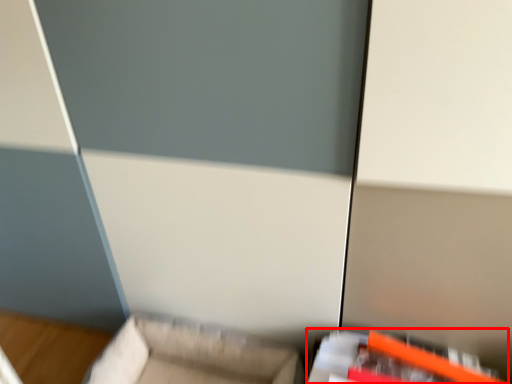
Question: From the image's perspective, considering the relative positions of furniture (annotated by the red box) and furniture in the image provided, where is furniture (annotated by the red box) located with respect to the staircase?

Choices:
 (A) below
 (B) above

Answer: (B)